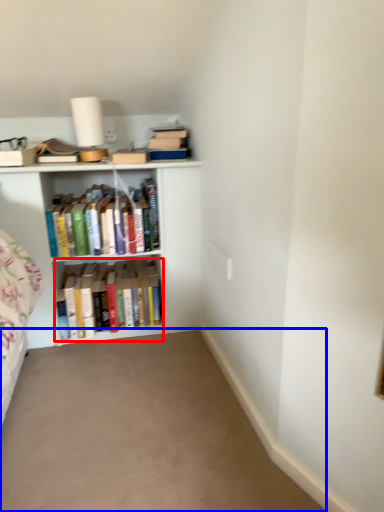
Question: Which of the following is the closest to the observer, book (highlighted by a red box) or plain (highlighted by a blue box)?

Choices:
 (A) book
 (B) plain

Answer: (B)